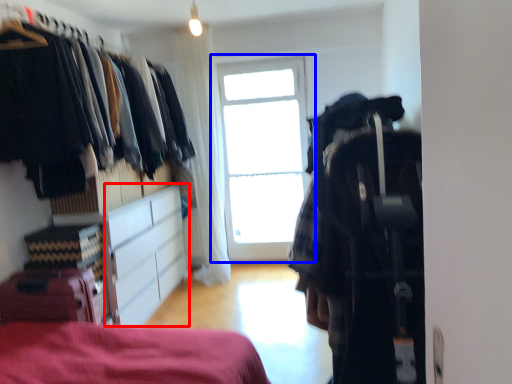
Question: Which object appears closest to the camera in this image, cabinetry (highlighted by a red box) or window (highlighted by a blue box)?

Choices:
 (A) cabinetry
 (B) window

Answer: (A)